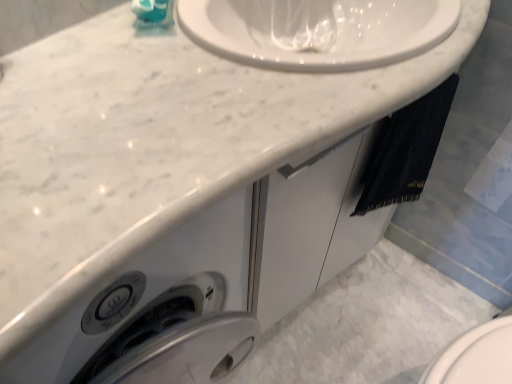
Question: Would you say teal glossy soap dispenser at upper left contains black denim towel at right?

Choices:
 (A) yes
 (B) no

Answer: (B)

Question: Is teal glossy soap dispenser at upper left taller than black denim towel at right?

Choices:
 (A) no
 (B) yes

Answer: (A)

Question: Does teal glossy soap dispenser at upper left appear on the left side of black denim towel at right?

Choices:
 (A) yes
 (B) no

Answer: (A)

Question: Does teal glossy soap dispenser at upper left have a greater width compared to black denim towel at right?

Choices:
 (A) yes
 (B) no

Answer: (A)

Question: Considering the relative sizes of teal glossy soap dispenser at upper left and black denim towel at right in the image provided, is teal glossy soap dispenser at upper left bigger than black denim towel at right?

Choices:
 (A) yes
 (B) no

Answer: (B)

Question: Is teal glossy soap dispenser at upper left directly adjacent to black denim towel at right?

Choices:
 (A) no
 (B) yes

Answer: (A)

Question: Can you confirm if black denim towel at right is positioned to the right of teal glossy soap dispenser at upper left?

Choices:
 (A) no
 (B) yes

Answer: (B)

Question: Is the position of black denim towel at right less distant than that of teal glossy soap dispenser at upper left?

Choices:
 (A) no
 (B) yes

Answer: (A)

Question: Could you tell me if black denim towel at right is facing teal glossy soap dispenser at upper left?

Choices:
 (A) no
 (B) yes

Answer: (A)

Question: From the image's perspective, is black denim towel at right on teal glossy soap dispenser at upper left?

Choices:
 (A) no
 (B) yes

Answer: (A)

Question: Is black denim towel at right further to camera compared to teal glossy soap dispenser at upper left?

Choices:
 (A) yes
 (B) no

Answer: (A)

Question: Does black denim towel at right have a greater width compared to teal glossy soap dispenser at upper left?

Choices:
 (A) yes
 (B) no

Answer: (B)

Question: Do you think black denim towel at right is within teal glossy soap dispenser at upper left, or outside of it?

Choices:
 (A) inside
 (B) outside

Answer: (B)